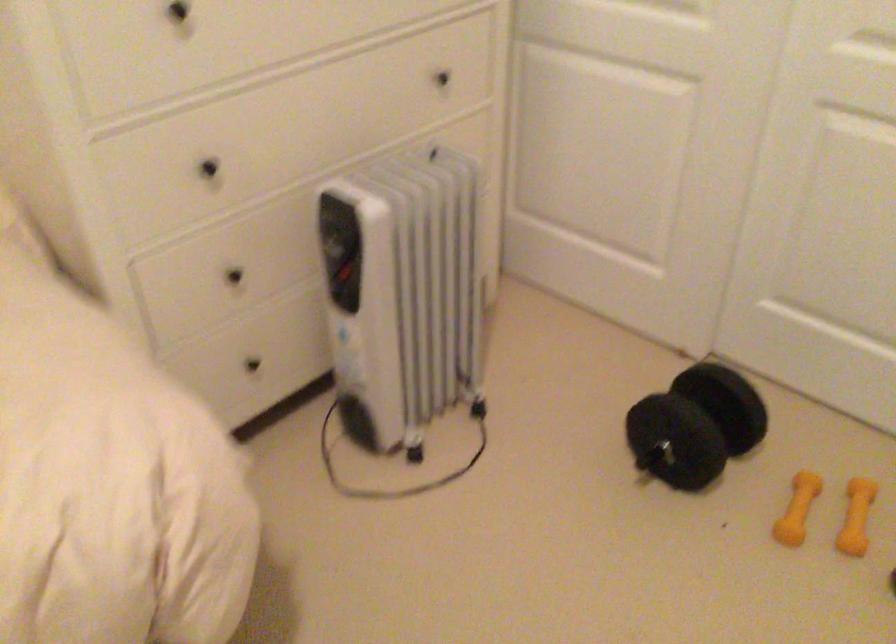
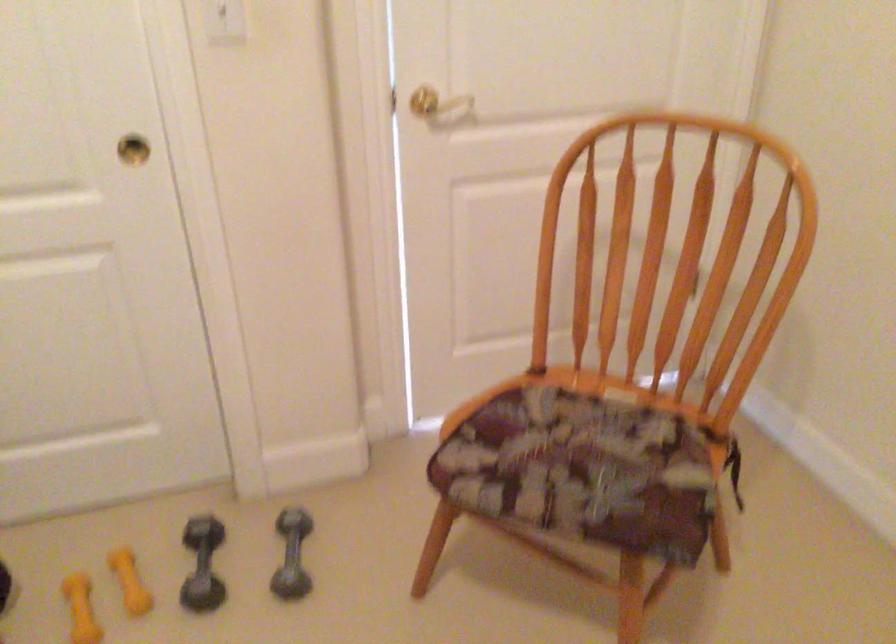
Question: The images are taken continuously from a first-person perspective. In which direction is your viewpoint rotating?

Choices:
 (A) Left
 (B) Right
 (C) Up
 (D) Down

Answer: (B)